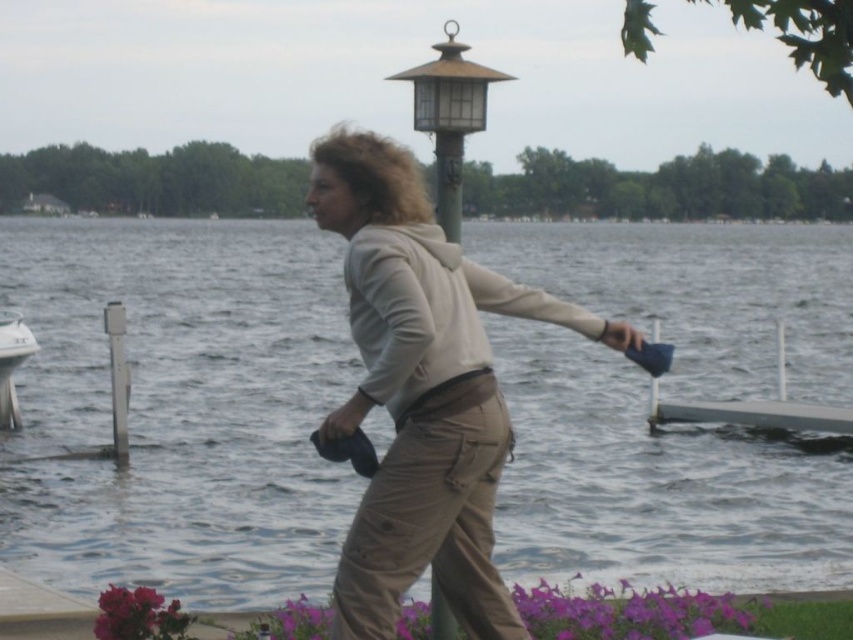
Does clear water at center have a larger size compared to white plastic boat at left?

Correct, clear water at center is larger in size than white plastic boat at left.

Which is in front, point (312, 400) or point (7, 410)?

Point (7, 410) is in front.

Based on the photo, who is more forward, (732, 342) or (27, 337)?

Point (27, 337) is more forward.

Image resolution: width=853 pixels, height=640 pixels. I want to click on clear water at center, so click(x=178, y=406).

Who is more forward, (672, 516) or (467, 348)?

Point (467, 348) is more forward.

Who is positioned more to the right, clear water at center or beige cotton hoodie at center?

From the viewer's perspective, beige cotton hoodie at center appears more on the right side.

This screenshot has width=853, height=640. In order to click on clear water at center in this screenshot , I will do `click(178, 406)`.

This screenshot has height=640, width=853. I want to click on clear water at center, so click(x=178, y=406).

Who is more forward, (457, 140) or (9, 401)?

Positioned in front is point (457, 140).

Is metallic gold lamp post at upper center smaller than white plastic boat at left?

Incorrect, metallic gold lamp post at upper center is not smaller in size than white plastic boat at left.

Between point (439, 86) and point (15, 323), which one is positioned in front?

Positioned in front is point (439, 86).

I want to click on metallic gold lamp post at upper center, so click(450, 116).